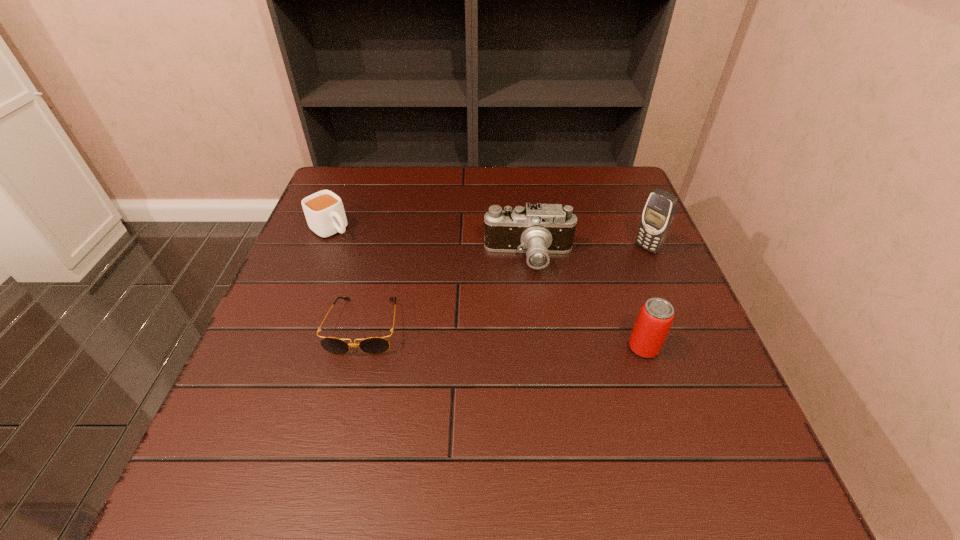
At what (x,y) coordinates should I click in order to perform the action: click on vacant space positioned 0.370m at the lens of the camera. Please return your answer as a coordinate pair (x, y). This screenshot has height=540, width=960. Looking at the image, I should click on (500, 417).

The width and height of the screenshot is (960, 540). What are the coordinates of `free space located 0.370m at the lens of the camera` in the screenshot? It's located at (500, 417).

Where is `vacant space positioned at the lens of the camera`? The width and height of the screenshot is (960, 540). vacant space positioned at the lens of the camera is located at coordinates (519, 301).

Image resolution: width=960 pixels, height=540 pixels. Find the location of `vacant space located on the side with the handle of the leftmost object`. vacant space located on the side with the handle of the leftmost object is located at coordinates (426, 303).

This screenshot has height=540, width=960. I want to click on free space located 0.380m on the side with the handle of the leftmost object, so tap(441, 314).

Where is `free space located on the side with the handle of the leftmost object`? free space located on the side with the handle of the leftmost object is located at coordinates (369, 258).

The height and width of the screenshot is (540, 960). I want to click on free region located on the front face of the cellular telephone, so [624, 266].

This screenshot has height=540, width=960. I want to click on free region located on the front face of the cellular telephone, so click(596, 287).

In order to click on vacant position located 0.310m on the front face of the cellular telephone in this screenshot , I will do `click(559, 315)`.

I want to click on sunglasses present at the left edge, so click(x=374, y=345).